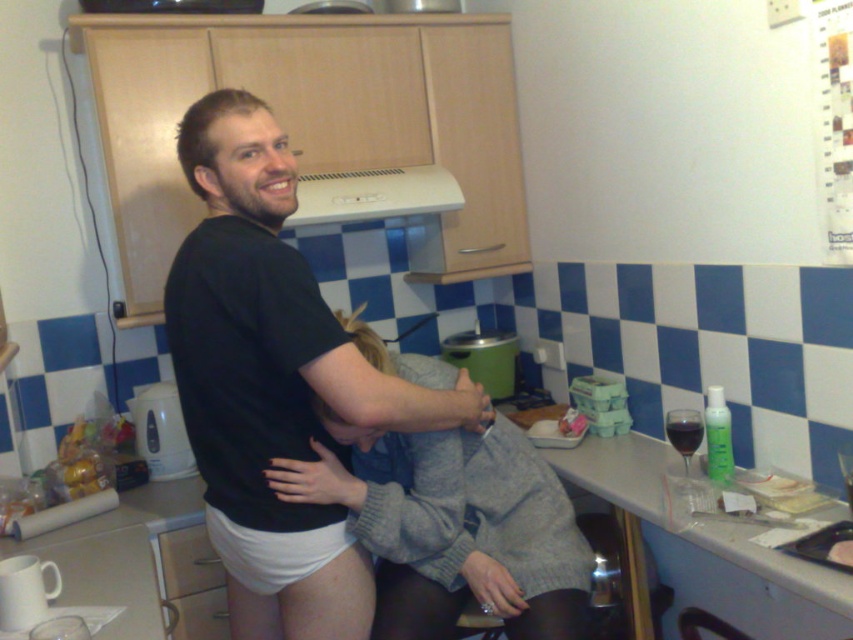
You are a chef standing in the kitchen and want to reach the white plastic exhaust hood at upper center to clean it. Is the white laminate counter at center blocking your direct access to it?

The white laminate counter at center is in front of the white plastic exhaust hood at upper center, so it is blocking your direct access to it.

You are a delivery person who just arrived at the address and need to place a new package on the counter. However, the package is as wide as the white matte underwear at center. Will it fit on the white laminate counter at center?

The white matte underwear at center is wider than the white laminate counter at center, so the package will not fit on the white laminate counter at center because it is wider than the counter.

You are standing in the kitchen and want to move from point A to point B. Point A is at coordinate point (x=331, y=365) and point B is at coordinate point (x=665, y=465). Considering the cluttered countertop with items like the green rice cooker, carton of eggs, bottle of lotion, and glass of red wine, can you safely walk from point A to point B without stepping on any of these items?

Point (x=331, y=365) is in front of point (x=665, y=465), so you can safely walk from point A to point B without stepping on the items on the countertop.